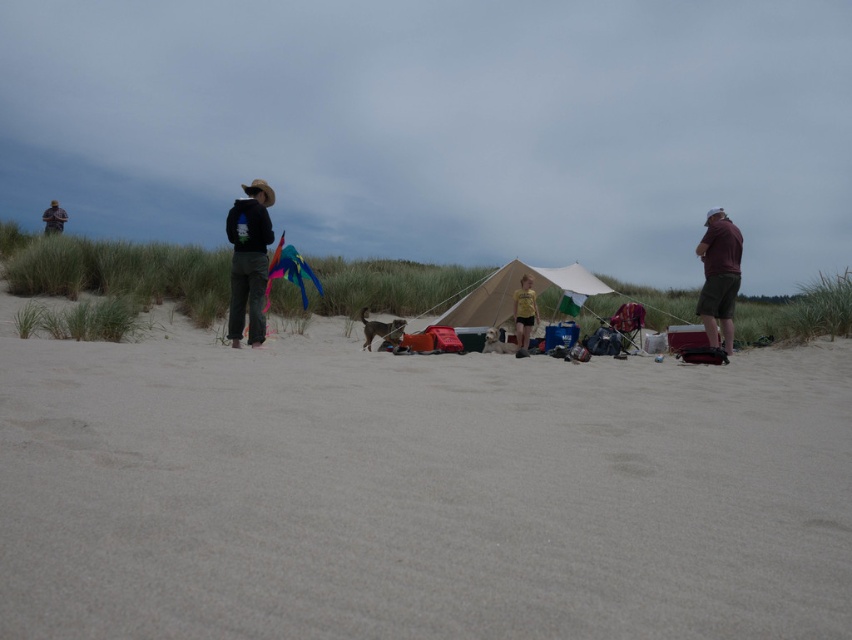
Who is more forward, [711,298] or [275,252]?

Point [711,298] is more forward.

Between maroon fabric shirt at right and multicolored fabric kite at center, which one appears on the left side from the viewer's perspective?

Positioned to the left is multicolored fabric kite at center.

What do you see at coordinates (718, 276) in the screenshot? The image size is (852, 640). I see `maroon fabric shirt at right` at bounding box center [718, 276].

You are a GUI agent. You are given a task and a screenshot of the screen. Output one action in this format:
    pyautogui.click(x=<x>, y=<y>)
    Task: Click on the maroon fabric shirt at right
    
    Given the screenshot: What is the action you would take?
    pyautogui.click(x=718, y=276)

Which is more to the right, multicolored fabric kite at center or camouflage jacket at left?

multicolored fabric kite at center is more to the right.

Can you confirm if multicolored fabric kite at center is positioned above camouflage jacket at left?

Incorrect, multicolored fabric kite at center is not positioned above camouflage jacket at left.

The width and height of the screenshot is (852, 640). Find the location of `multicolored fabric kite at center`. multicolored fabric kite at center is located at coordinates (289, 269).

Is black cotton hoodie at center positioned at the back of camouflage jacket at left?

No, it is not.

Describe the element at coordinates (248, 260) in the screenshot. The width and height of the screenshot is (852, 640). I see `black cotton hoodie at center` at that location.

Image resolution: width=852 pixels, height=640 pixels. Find the location of `black cotton hoodie at center`. black cotton hoodie at center is located at coordinates (248, 260).

Where is `black cotton hoodie at center`? The image size is (852, 640). black cotton hoodie at center is located at coordinates (248, 260).